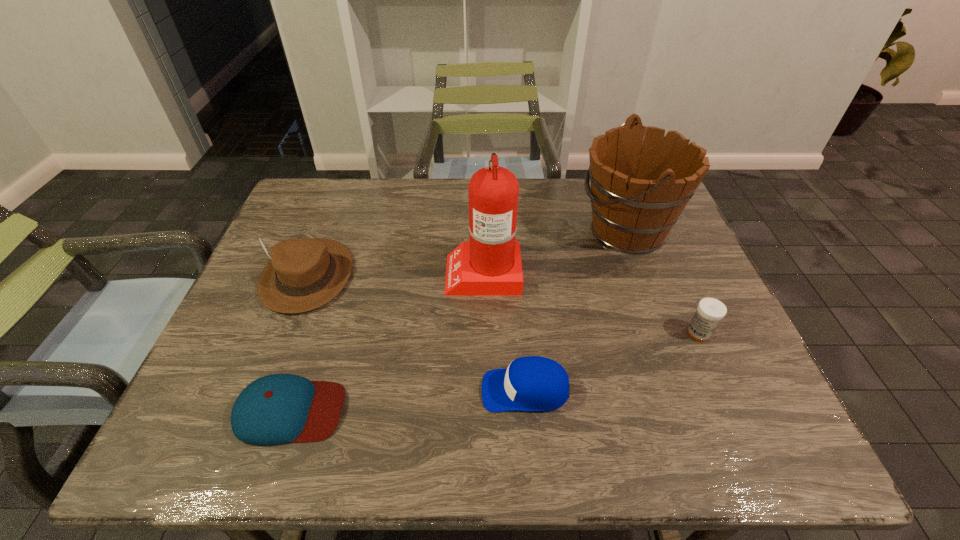
Identify the location of object at the far edge. The height and width of the screenshot is (540, 960). (639, 188).

In order to click on object present at the near edge in this screenshot , I will do `click(279, 408)`.

Where is `fedora at the left edge`? fedora at the left edge is located at coordinates (303, 274).

Where is `baseball cap located at the left edge`? baseball cap located at the left edge is located at coordinates (279, 408).

Where is `wine bucket positioned at the right edge`? wine bucket positioned at the right edge is located at coordinates (639, 188).

This screenshot has width=960, height=540. Identify the location of medicine that is at the right edge. (710, 311).

Where is `object present at the near left corner`? object present at the near left corner is located at coordinates (279, 408).

The image size is (960, 540). I want to click on object present at the far right corner, so click(x=639, y=188).

Locate an element on the screen. The height and width of the screenshot is (540, 960). free region at the far edge is located at coordinates (575, 185).

Where is `vacant space at the near edge`? The height and width of the screenshot is (540, 960). vacant space at the near edge is located at coordinates pyautogui.click(x=528, y=438).